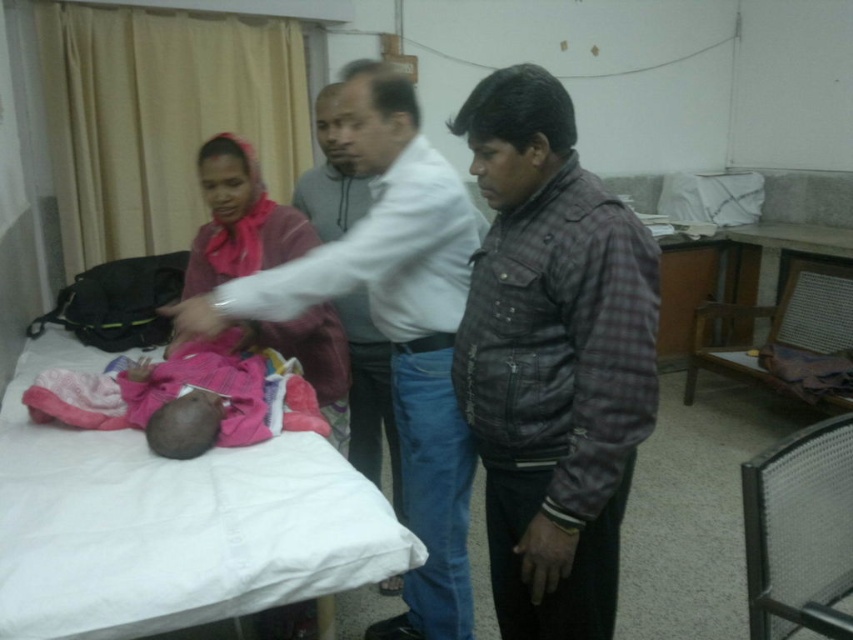
You are a nurse in the hospital. You need to move the plaid leather jacket at right and the pink fabric baby at lower left to different locations. Which object should you move first if you want to prioritize moving the taller object first?

You should move the plaid leather jacket at right first because it has a greater height compared to the pink fabric baby at lower left.

You are a nurse in the hospital and need to retrieve the plaid leather jacket at right to give to a patient. However, you must avoid blocking the view of the baby in the white fabric bed at center. Can you move to the jacket without standing in front of the bed?

The plaid leather jacket at right is located to the right of the white fabric bed at center. Since it is positioned to the side, you can approach it from the right side without obstructing the view of the baby in the white fabric bed at center.

You are a nurse in the hospital and need to determine if the pink fabric baby at center can fit into a standard incubator that requires the object to be narrower than the pink fabric headscarf at upper left. Can the baby fit?

The pink fabric baby at center might be wider than pink fabric headscarf at upper left, so it may not fit into the incubator if the incubator requires the object to be narrower than the headscarf.